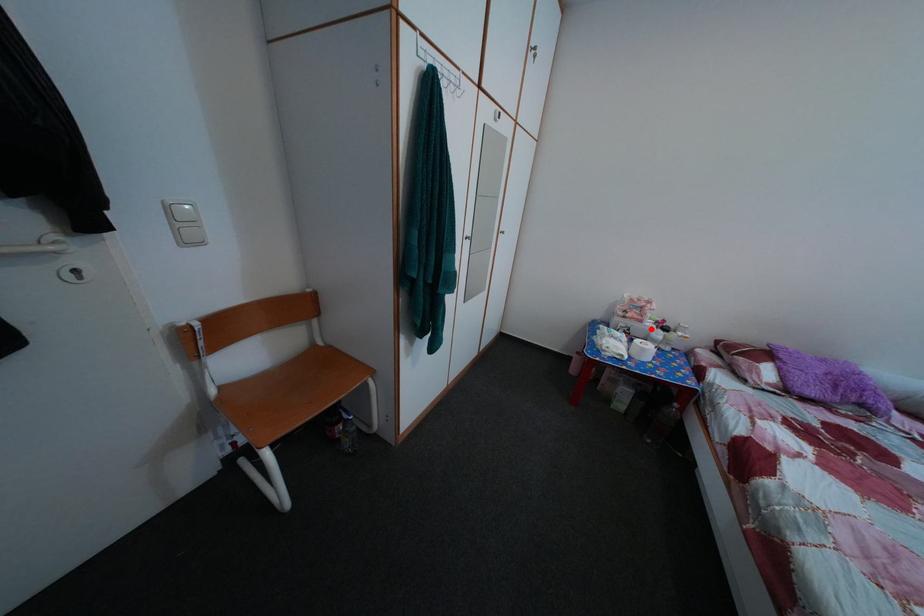
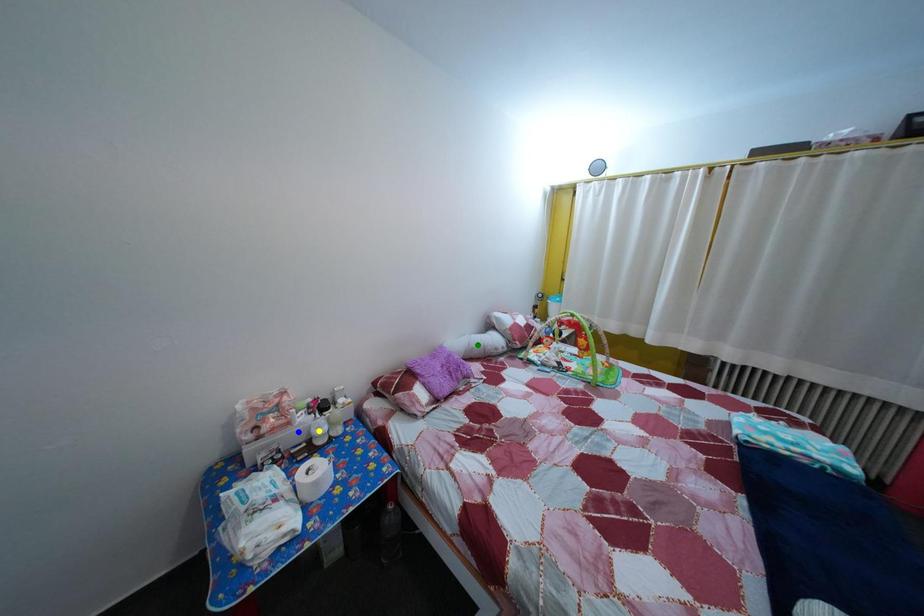
Question: I am providing you with two images of the same scene from different viewpoints. A red point is marked on the first image. You are given multiple points on the second image. Can you choose the point in image 2 that corresponds to the point in image 1?

Choices:
 (A) green point
 (B) yellow point
 (C) blue point

Answer: (C)